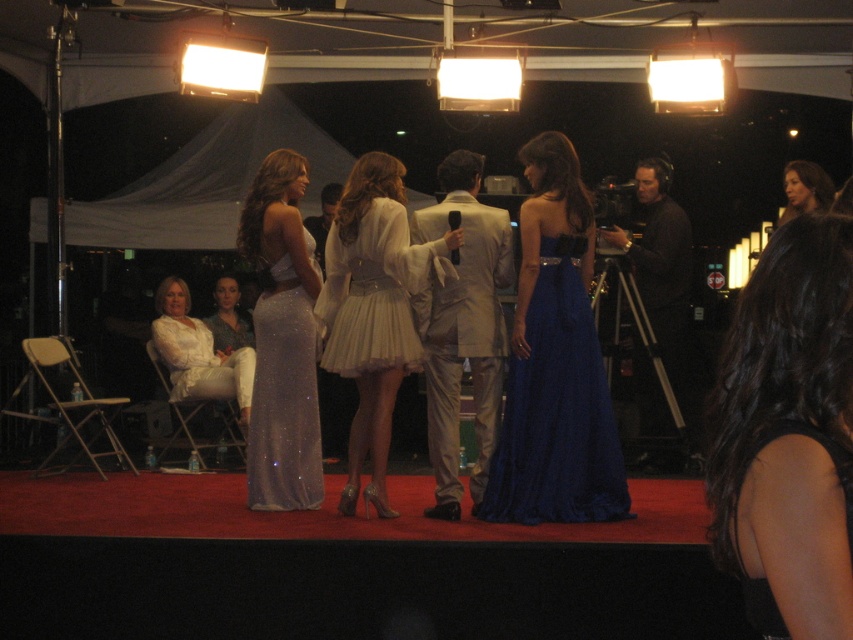
Based on the photo, you are a photographer on the stage, and you need to take a photo of both the white satin dress at left and the matte white dress at center. Based on their positions, which dress is closer to the front of the stage?

The white satin dress at left is closer to the front of the stage because it is located below the matte white dress at center, indicating it is positioned in front.

You are a photographer positioned at the back of the stage. You need to capture a photo that includes both the white satin dress at left and the matte white dress at center. Which dress should you focus on first to ensure both are in frame?

The white satin dress at left is to the right of the matte white dress at center. Therefore, to include both in the frame, you should focus on the matte white dress at center first, as it is positioned to the left of the white satin dress at left.

In the image, there is a point labeled at coordinates (372,294). Which object from the scene does this point correspond to?

The point at coordinates (372,294) corresponds to the white satin dress at center.